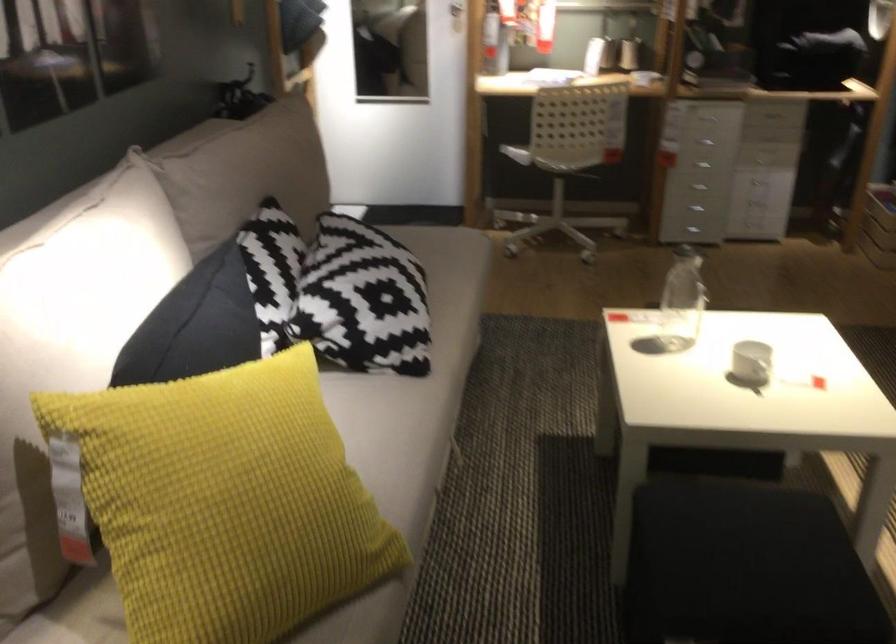
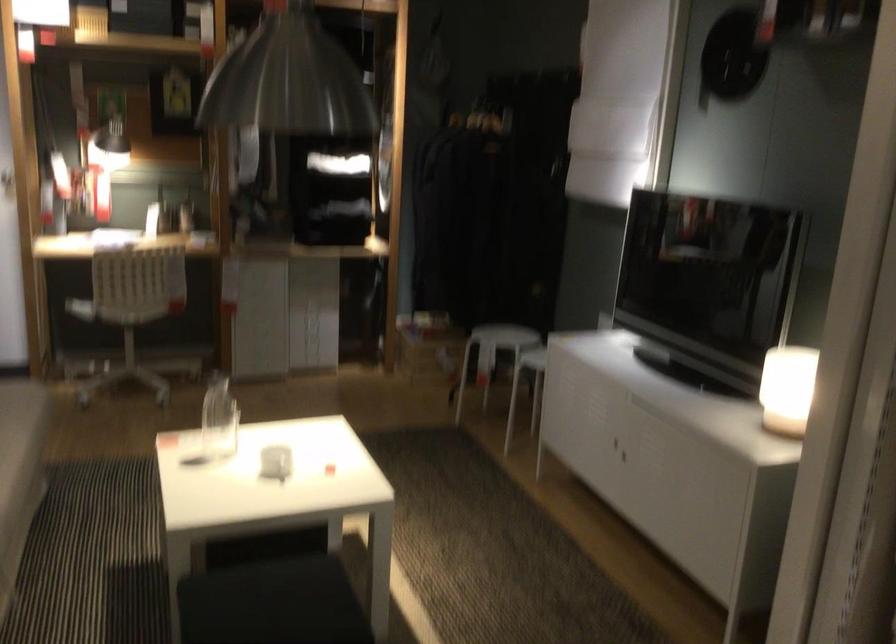
The point at [523,151] is marked in the first image. Where is the corresponding point in the second image?

(80, 308)